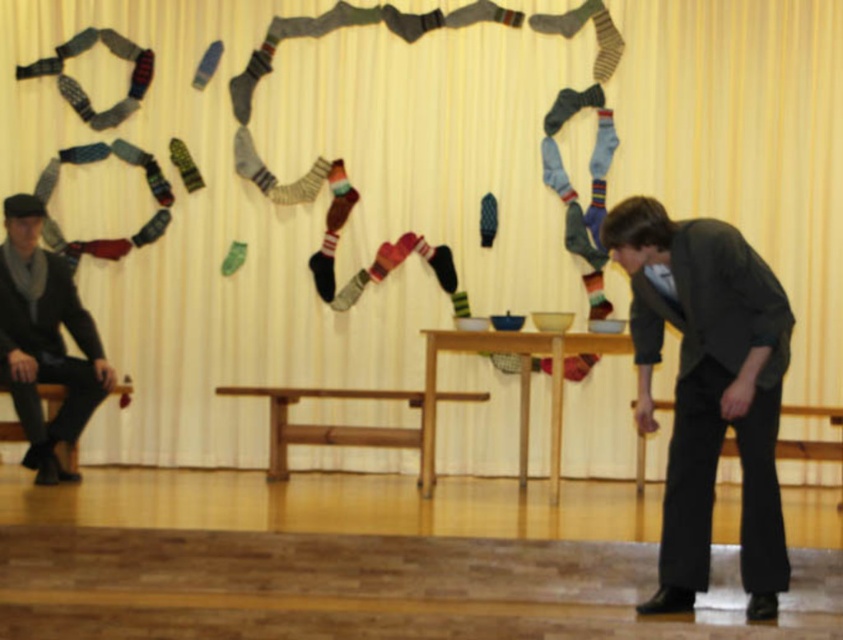
Can you confirm if matte yellow curtain at upper center is taller than dark gray suit at right?

No.

Who is shorter, matte yellow curtain at upper center or dark gray suit at right?

Standing shorter between the two is matte yellow curtain at upper center.

Is point (234, 458) farther from camera compared to point (706, 259)?

Yes, point (234, 458) is farther from viewer.

Locate an element on the screen. matte yellow curtain at upper center is located at coordinates (202, 246).

Where is `dark gray suit at right`? The image size is (843, 640). dark gray suit at right is located at coordinates (707, 390).

Is dark gray suit at right bigger than wooden bench at center?

Yes.

What do you see at coordinates (707, 390) in the screenshot?
I see `dark gray suit at right` at bounding box center [707, 390].

At what (x,y) coordinates should I click in order to perform the action: click on dark gray suit at right. Please return your answer as a coordinate pair (x, y). The image size is (843, 640). Looking at the image, I should click on (707, 390).

Is matte black suit at left above wooden stool at left?

Correct, matte black suit at left is located above wooden stool at left.

Is point (9, 378) more distant than point (63, 449)?

No, (9, 378) is in front of (63, 449).

The height and width of the screenshot is (640, 843). In order to click on matte black suit at left in this screenshot , I will do `click(44, 340)`.